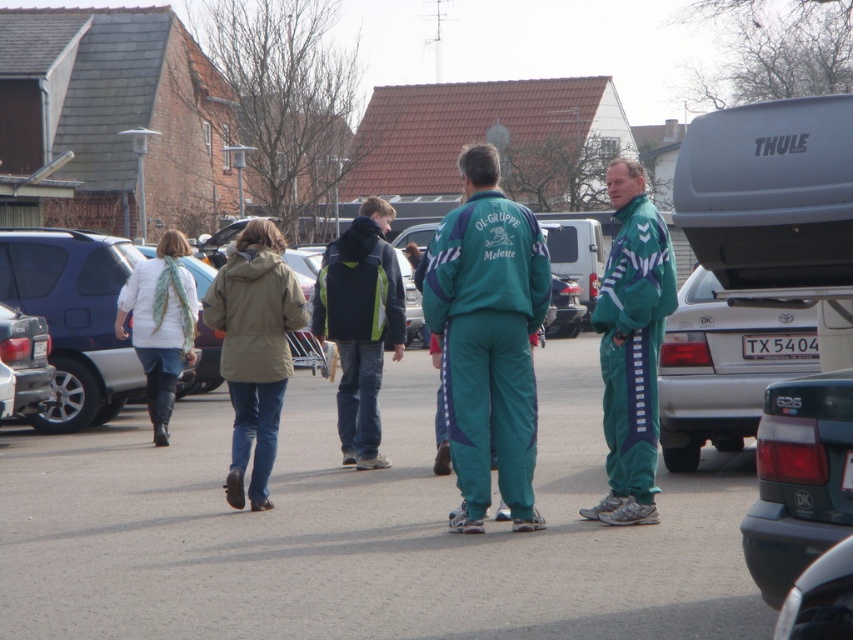
Which is below, dark green plastic car at lower right or light blue denim jeans at lower left?

Positioned lower is dark green plastic car at lower right.

Does dark green plastic car at lower right appear under light blue denim jeans at lower left?

Indeed, dark green plastic car at lower right is positioned under light blue denim jeans at lower left.

This screenshot has height=640, width=853. Identify the location of dark green plastic car at lower right. (799, 480).

Does matte black suv at left have a greater width compared to dark blue jacket at center?

Yes, matte black suv at left is wider than dark blue jacket at center.

Measure the distance between matte black suv at left and camera.

matte black suv at left is 51.17 feet away from camera.

What do you see at coordinates (74, 317) in the screenshot? I see `matte black suv at left` at bounding box center [74, 317].

Where is `matte black suv at left`? matte black suv at left is located at coordinates (74, 317).

What do you see at coordinates (488, 339) in the screenshot? I see `teal tracksuit at center` at bounding box center [488, 339].

Between teal tracksuit at center and dark blue jacket at center, which one appears on the right side from the viewer's perspective?

teal tracksuit at center

Is point (527, 298) closer to viewer compared to point (363, 416)?

Yes, point (527, 298) is in front of point (363, 416).

This screenshot has width=853, height=640. Identify the location of teal tracksuit at center. (488, 339).